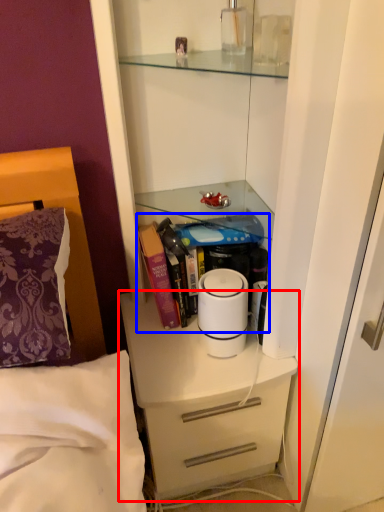
Question: Which of the following is the farthest to the observer, chest of drawers (highlighted by a red box) or book (highlighted by a blue box)?

Choices:
 (A) chest of drawers
 (B) book

Answer: (B)